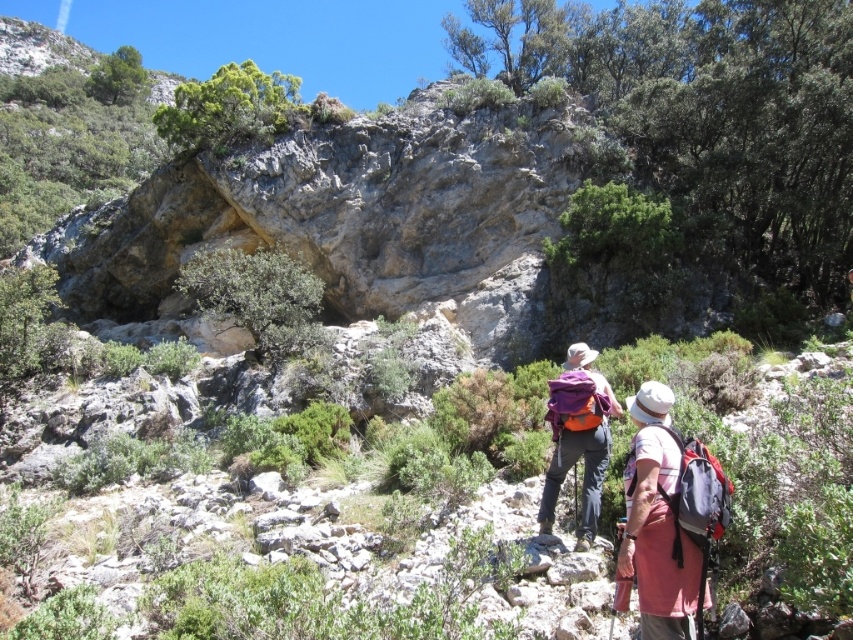
Can you confirm if pink fabric backpack at center-right is positioned below purple fabric backpack at center?

No, pink fabric backpack at center-right is not below purple fabric backpack at center.

Which of these two, pink fabric backpack at center-right or purple fabric backpack at center, stands shorter?

Standing shorter between the two is purple fabric backpack at center.

Which is behind, point (677, 605) or point (541, 515)?

Point (541, 515)

Identify the location of pink fabric backpack at center-right. The height and width of the screenshot is (640, 853). (656, 524).

Can you confirm if matte purple backpack at center is bigger than pink fabric backpack at center-right?

Indeed, matte purple backpack at center has a larger size compared to pink fabric backpack at center-right.

Is matte purple backpack at center smaller than pink fabric backpack at center-right?

Incorrect, matte purple backpack at center is not smaller in size than pink fabric backpack at center-right.

Consider the image. Who is more distant from viewer, (698, 611) or (618, 604)?

Positioned behind is point (618, 604).

Where is `matte purple backpack at center`? The image size is (853, 640). matte purple backpack at center is located at coordinates (666, 518).

Between point (659, 454) and point (598, 465), which one is positioned behind?

The point (598, 465) is more distant.

Locate an element on the screen. The image size is (853, 640). matte purple backpack at center is located at coordinates (666, 518).